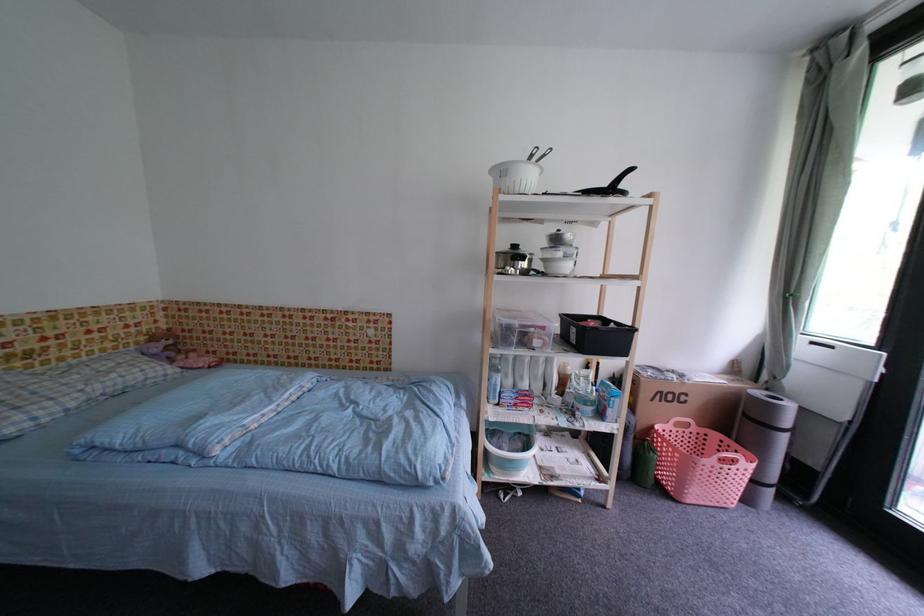
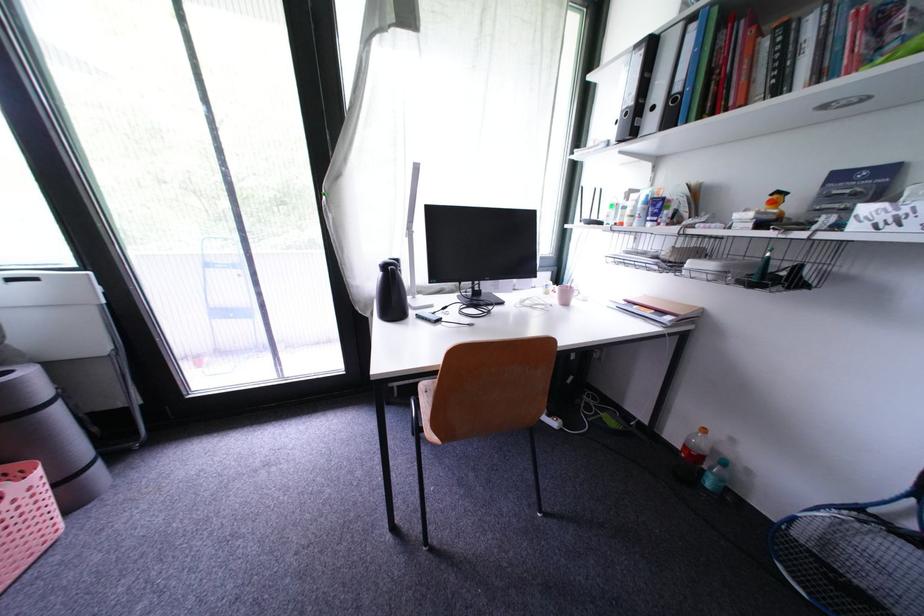
How did the camera likely rotate?

The camera's rotation is toward right-down.